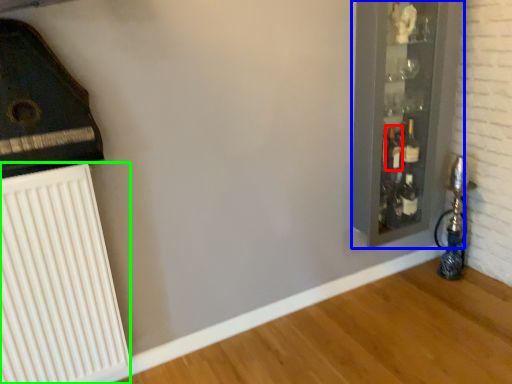
Question: Based on their relative distances, which object is farther from bottle (highlighted by a red box)? Choose from glass door (highlighted by a blue box) and radiator (highlighted by a green box).

Choices:
 (A) glass door
 (B) radiator

Answer: (B)